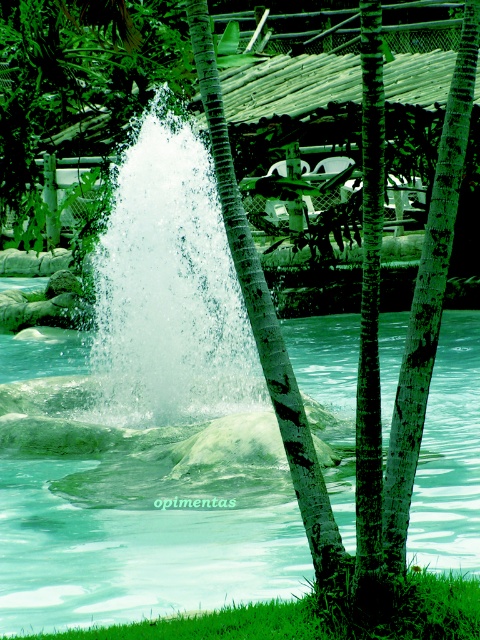
Question: Which point appears closest to the camera in this image?

Choices:
 (A) (230, 264)
 (B) (278, 557)

Answer: (B)

Question: Which of the following is the farthest from the observer?

Choices:
 (A) (37, 592)
 (B) (157, 356)

Answer: (B)

Question: Is clear water pool at center above white frothy water at center?

Choices:
 (A) yes
 (B) no

Answer: (B)

Question: Is clear water pool at center wider than white frothy water at center?

Choices:
 (A) no
 (B) yes

Answer: (B)

Question: Which point is closer to the camera?

Choices:
 (A) (243, 536)
 (B) (124, 330)

Answer: (A)

Question: Is clear water pool at center above white frothy water at center?

Choices:
 (A) yes
 (B) no

Answer: (B)